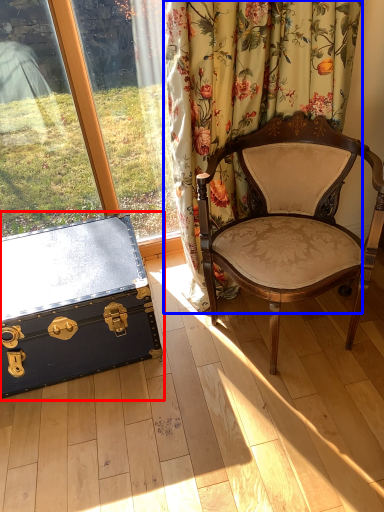
Question: Which point is closer to the camera, box (highlighted by a red box) or curtain (highlighted by a blue box)?

Choices:
 (A) box
 (B) curtain

Answer: (B)